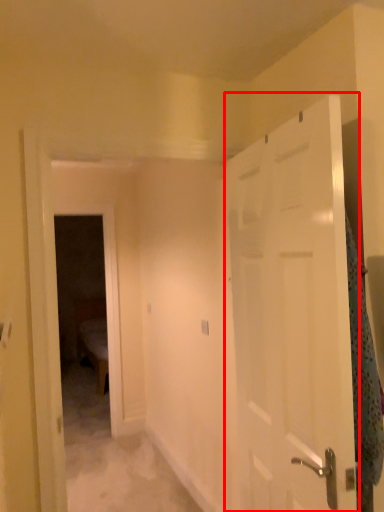
Question: From the image's perspective, what is the correct spatial relationship of door (annotated by the red box) in relation to blanket?

Choices:
 (A) below
 (B) above

Answer: (A)